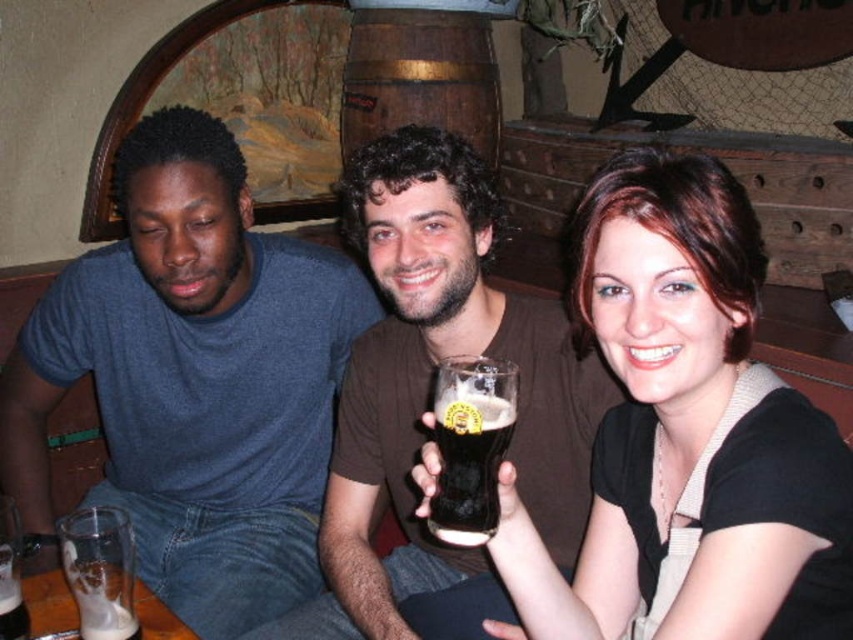
You are a waiter at this pub and need to deliver a drink to the person wearing the matte blue shirt at left. The drink you have is in a glass that is 10 inches wide. Can you place the drink on the table without it overlapping the translucent glass mug at lower left?

The distance between the matte blue shirt at left and the translucent glass mug at lower left is 18.92 inches. Since the drink glass is only 10 inches wide, placing it between them would require at least 10 inches of space. However, the existing distance is 18.92 inches, which is more than enough. Therefore, you can safely place the drink on the table without overlapping the translucent glass mug at lower left.